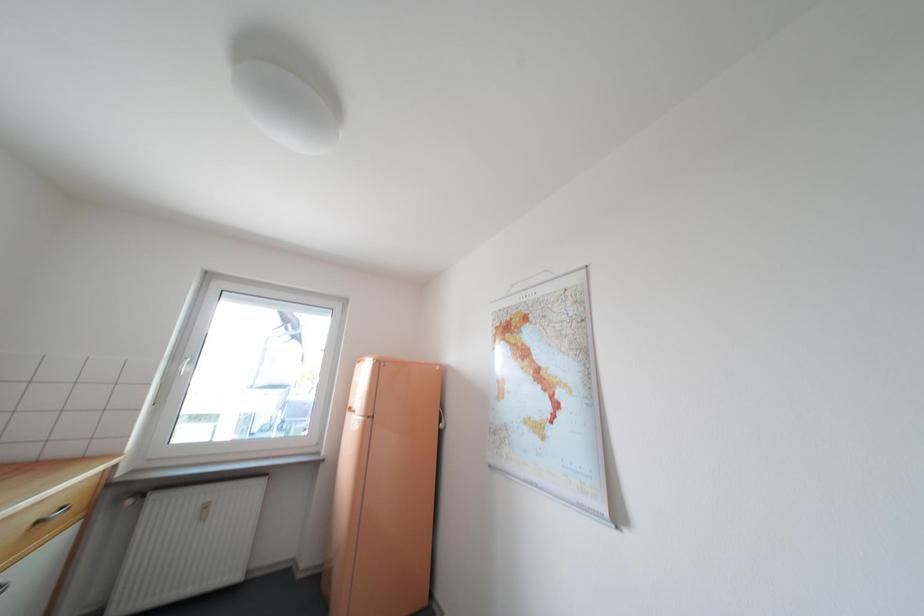
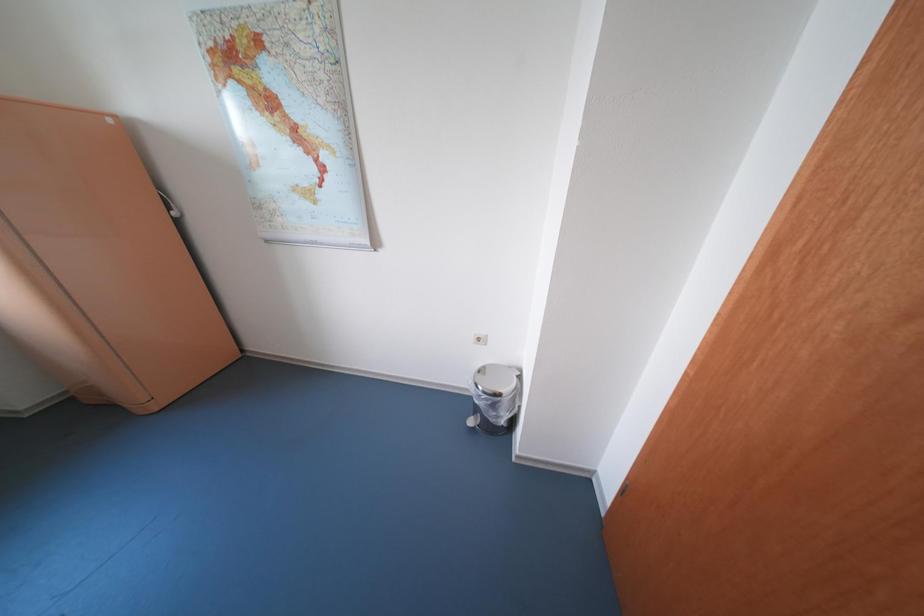
The first image is from the beginning of the video and the second image is from the end. How did the camera likely rotate when shooting the video?

The camera rotated toward right-down.